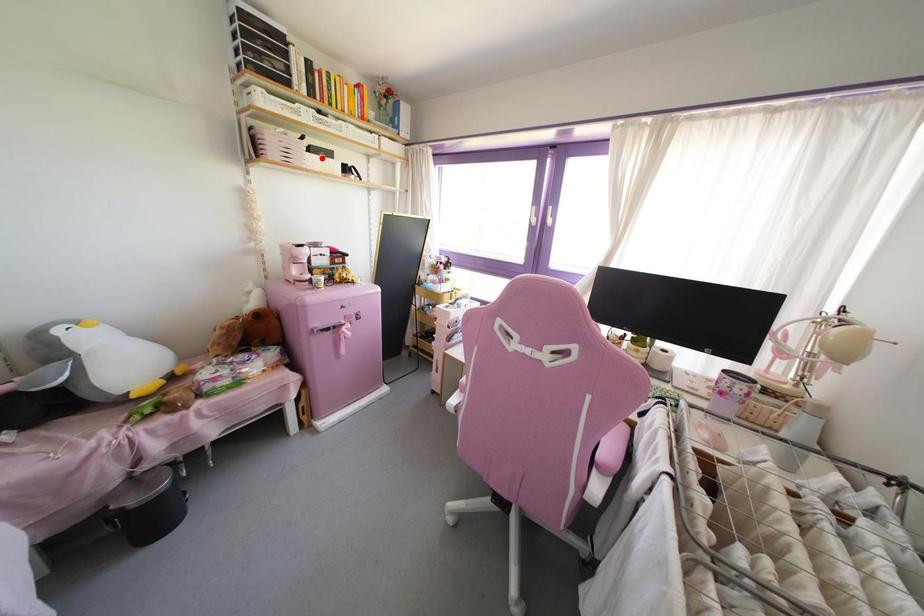
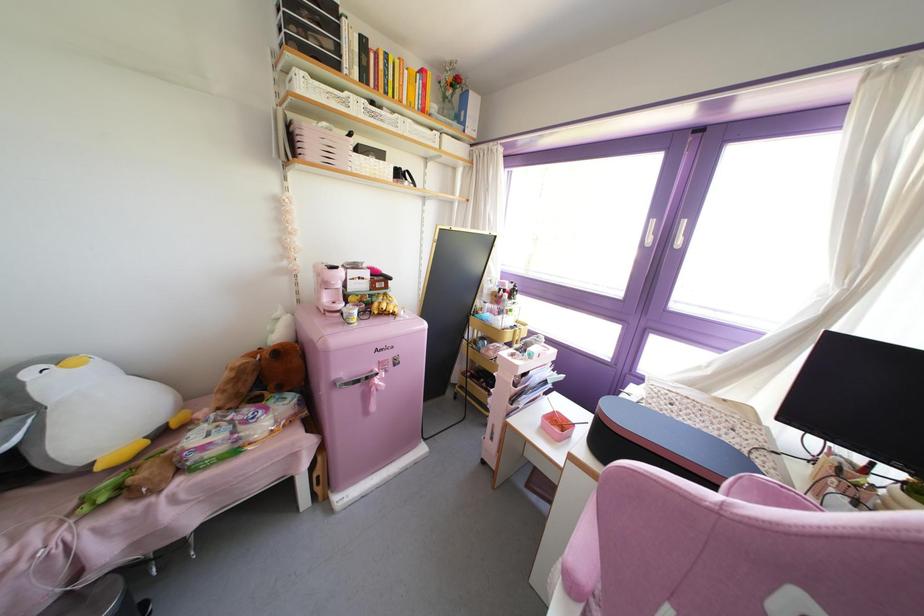
In the second image, find the point that corresponds to the highlighted location in the first image.

(371, 160)